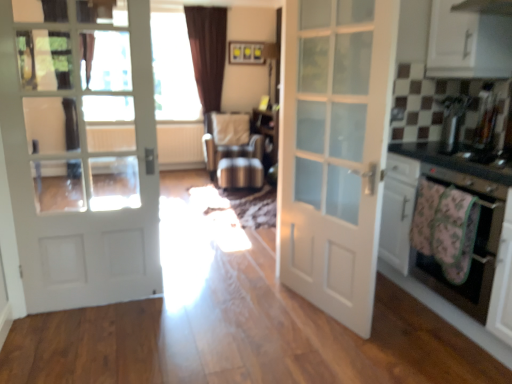
Question: Considering the positions of point (466, 231) and point (239, 168), is point (466, 231) closer or farther from the camera than point (239, 168)?

Choices:
 (A) closer
 (B) farther

Answer: (A)

Question: Would you say fluffy floral blanket at lower right is inside or outside metallic silver chair at center?

Choices:
 (A) inside
 (B) outside

Answer: (B)

Question: Which object is the farthest from the white glass door at left, positioned as the first door in left-to-right order?

Choices:
 (A) transparent glass door at upper center
 (B) black glossy countertop at right
 (C) fluffy floral blanket at lower right
 (D) metallic silver chair at center
 (E) satin silver toaster at upper right

Answer: (A)

Question: Which is nearer to the metallic silver chair at center?

Choices:
 (A) transparent glass door at upper center
 (B) pink fabric oven at right
 (C) black glossy countertop at right
 (D) white glossy cabinet at upper right
 (E) white textured radiator at center

Answer: (E)